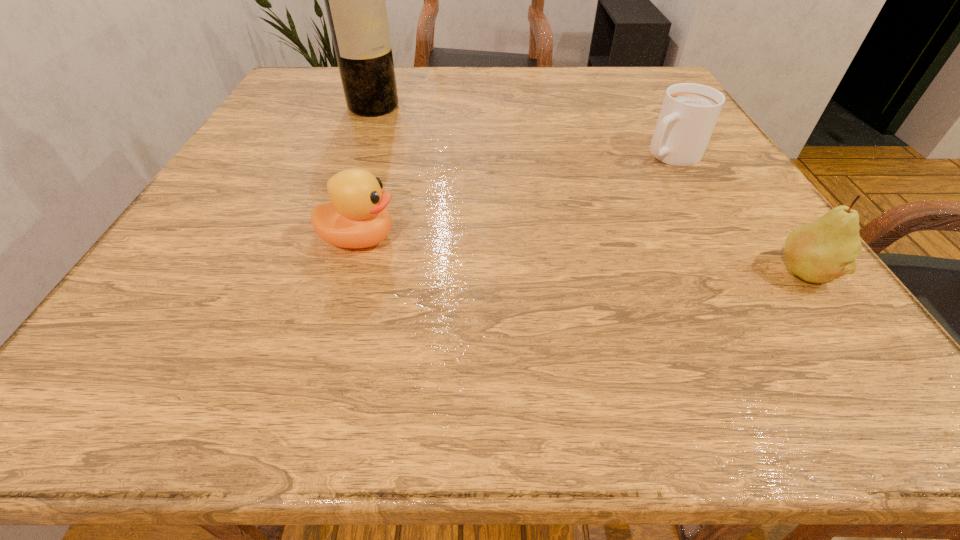
Where is `vacant spot on the desktop that is between the duckling and the pear and is positioned on the side with the handle of the second farthest object`? vacant spot on the desktop that is between the duckling and the pear and is positioned on the side with the handle of the second farthest object is located at coordinates (523, 252).

Identify the location of vacant space on the desktop that is between the duckling and the pear and is positioned on the front-facing side of the tallest object. (564, 254).